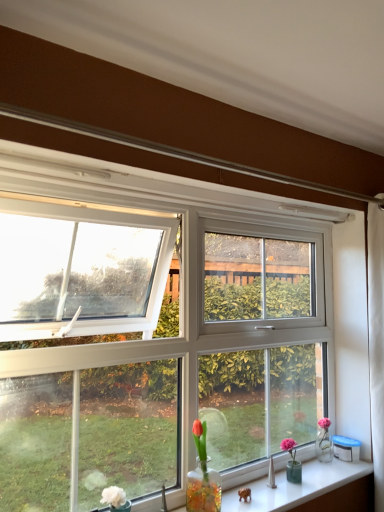
Where is `white glossy window sill at lower right`? Image resolution: width=384 pixels, height=512 pixels. white glossy window sill at lower right is located at coordinates (300, 487).

Image resolution: width=384 pixels, height=512 pixels. What do you see at coordinates (300, 487) in the screenshot?
I see `white glossy window sill at lower right` at bounding box center [300, 487].

Find the location of a particular element. This screenshot has height=512, width=384. white glossy window sill at lower right is located at coordinates (300, 487).